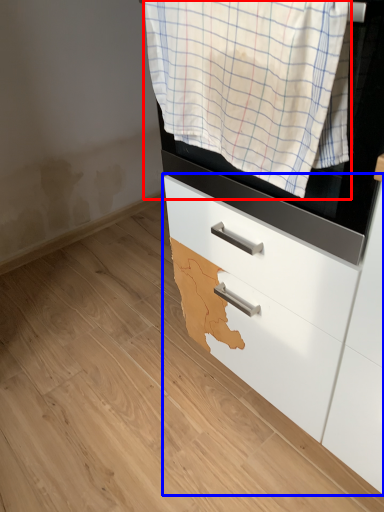
Question: Which point is closer to the camera, clothing (highlighted by a red box) or chest of drawers (highlighted by a blue box)?

Choices:
 (A) clothing
 (B) chest of drawers

Answer: (A)